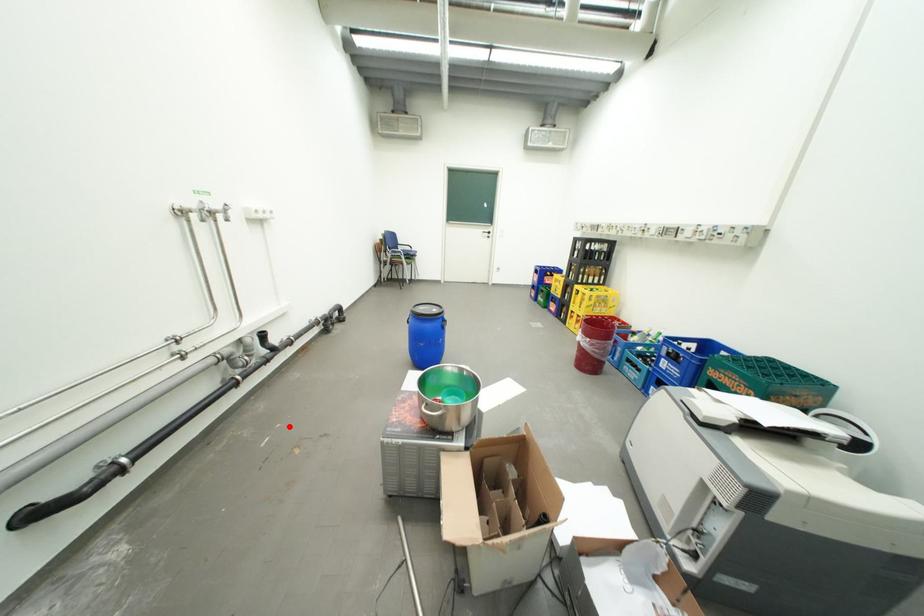
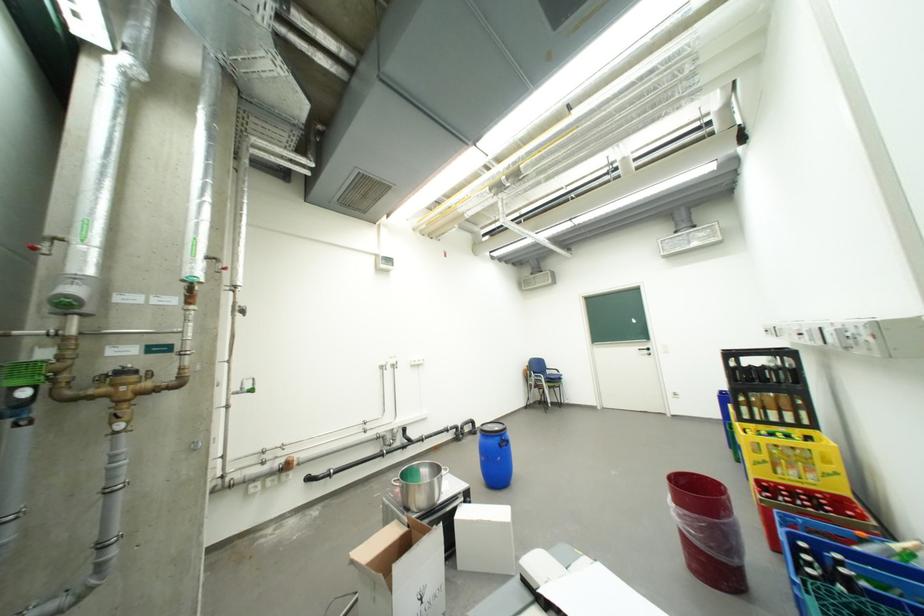
Question: I am providing you with two images of the same scene from different viewpoints. Image1 has a red point marked. In image2, the corresponding 3D location appears at what relative position? Reply with the corresponding letter.

Choices:
 (A) Closer
 (B) Farther

Answer: (B)